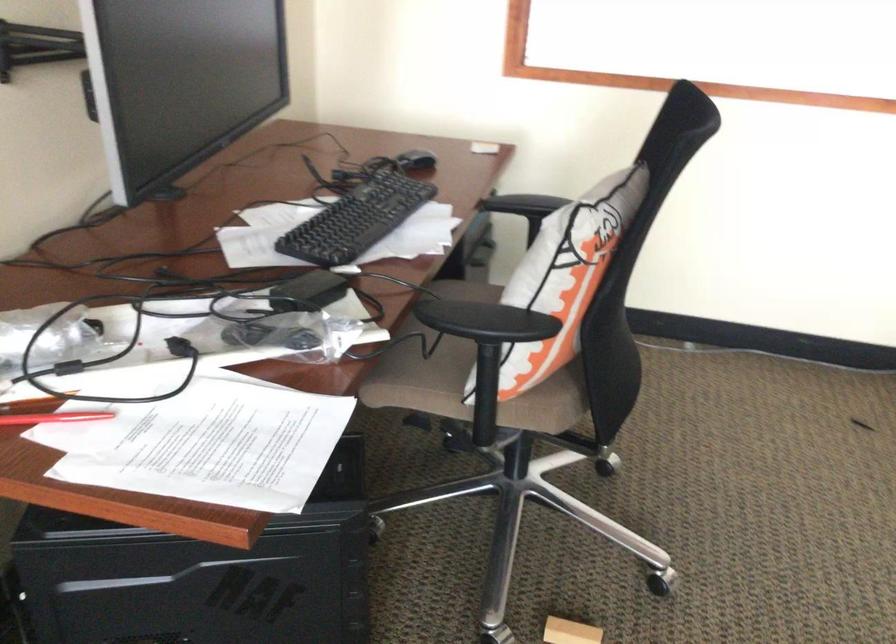
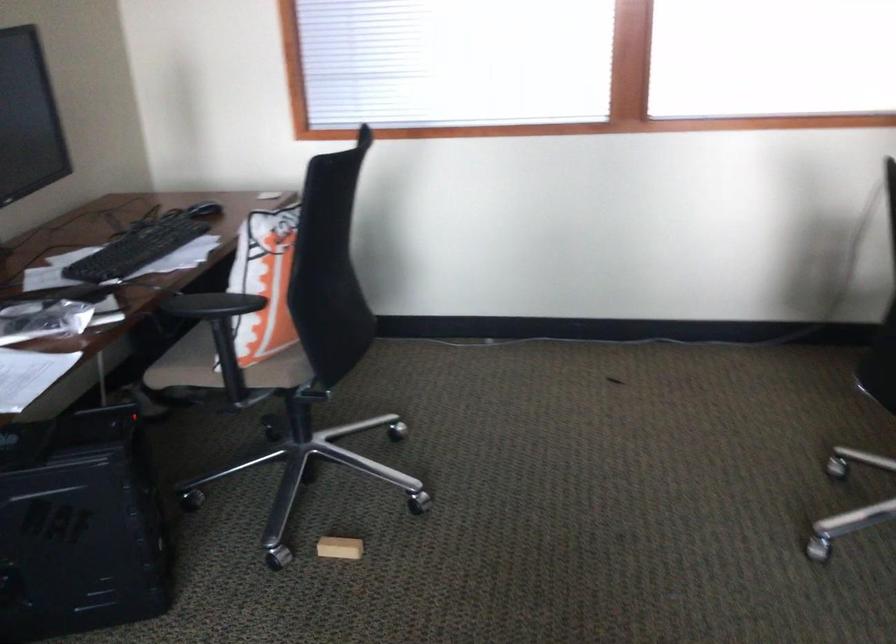
The point at (x=484, y=406) is marked in the first image. Where is the corresponding point in the second image?

(228, 370)